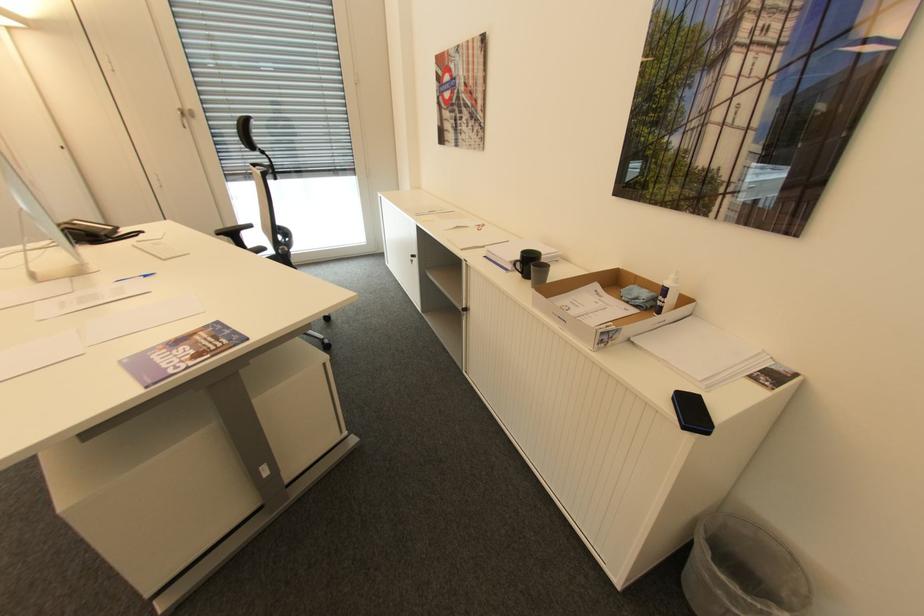
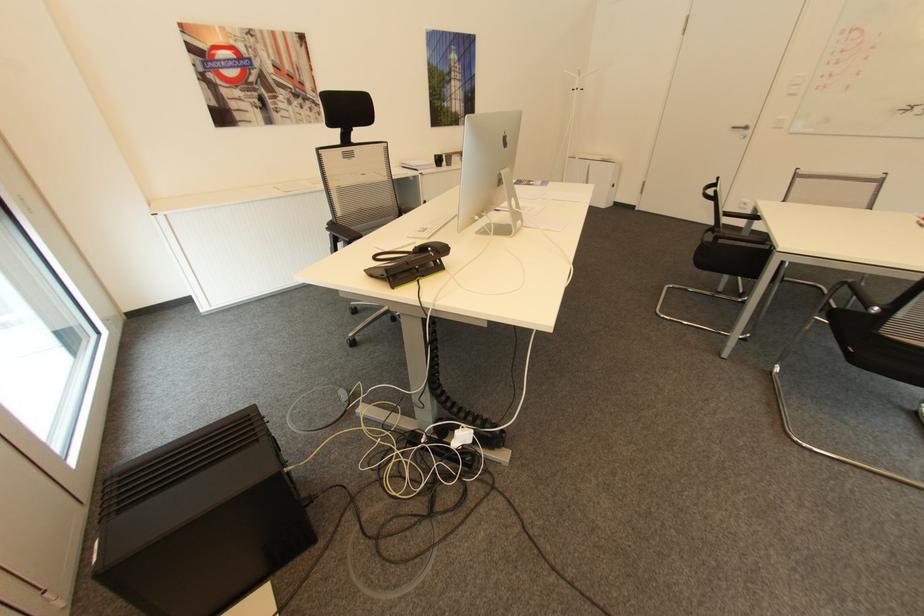
Question: I am providing you with two images of the same scene from different viewpoints. Which of the following objects are not visible in image2?

Choices:
 (A) silver door handle
 (B) black mesh chair surface
 (C) striped chair sitting surface
 (D) none of these

Answer: (D)